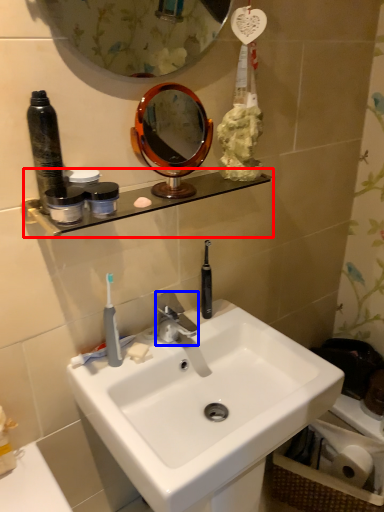
Question: Which of the following is the closest to the observer, shelve (highlighted by a red box) or faucet (highlighted by a blue box)?

Choices:
 (A) shelve
 (B) faucet

Answer: (A)